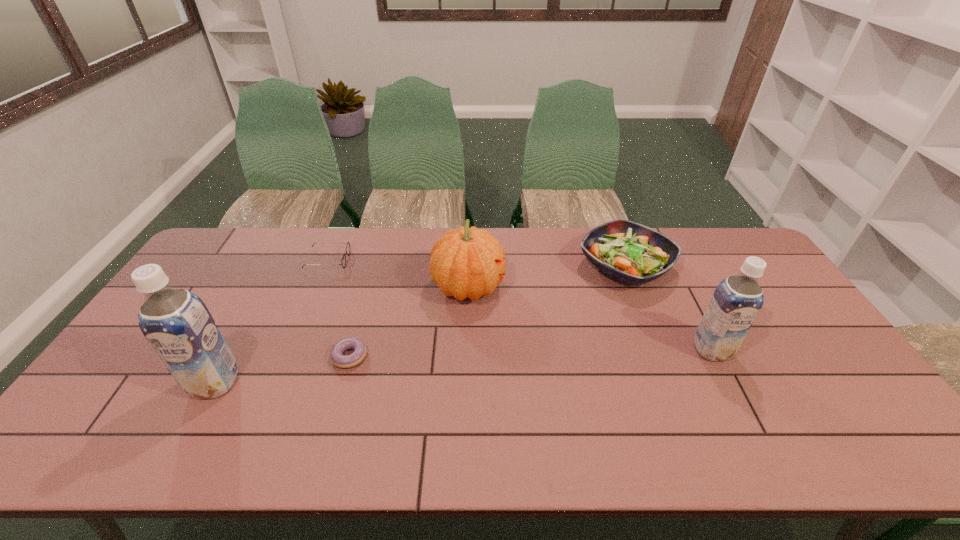
Where is `the fourth object from left to right`? This screenshot has height=540, width=960. the fourth object from left to right is located at coordinates (465, 262).

You are a GUI agent. You are given a task and a screenshot of the screen. Output one action in this format:
    pyautogui.click(x=<x>, y=<y>)
    Task: Click on the vacant area situated 0.160m on the label of the second tallest object
    The image size is (960, 540).
    Given the screenshot: What is the action you would take?
    pyautogui.click(x=746, y=416)

Where is `free space located on the front-facing side of the sunglasses`? free space located on the front-facing side of the sunglasses is located at coordinates (365, 260).

What are the coordinates of `free spot located on the right of the salad plate` in the screenshot? It's located at (754, 267).

Locate an element on the screen. The width and height of the screenshot is (960, 540). free point located 0.120m on the front of the shortest object is located at coordinates (334, 411).

Identify the location of blank space located on the carved face of the fourth shortest object. (595, 287).

Where is `sunglasses at the far edge`? This screenshot has width=960, height=540. sunglasses at the far edge is located at coordinates (343, 261).

Identify the location of salad plate that is at the far edge. (630, 252).

Image resolution: width=960 pixels, height=540 pixels. I want to click on pumpkin at the far edge, so click(465, 262).

Find the location of a particular element. Image resolution: width=960 pixels, height=540 pixels. object positioned at the near edge is located at coordinates (176, 323).